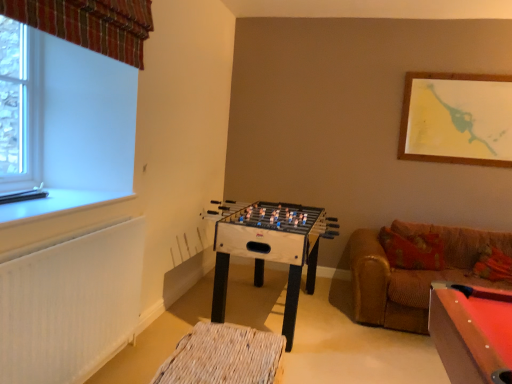
What do you see at coordinates (271, 250) in the screenshot? This screenshot has height=384, width=512. I see `wooden foosball table at center` at bounding box center [271, 250].

The height and width of the screenshot is (384, 512). Describe the element at coordinates (19, 106) in the screenshot. I see `clear glass window at upper left` at that location.

The height and width of the screenshot is (384, 512). What are the coordinates of `clear glass window at upper left` in the screenshot? It's located at point(19,106).

Describe the element at coordinates (224, 356) in the screenshot. The image size is (512, 384). I see `woven wood footrest at lower center` at that location.

Identify the location of wooden foosball table at center. Image resolution: width=512 pixels, height=384 pixels. (271, 250).

Is clear glass window at upper left in contact with white textured radiator at lower left?

clear glass window at upper left and white textured radiator at lower left are not in contact.

Which object is wider, clear glass window at upper left or white textured radiator at lower left?

With larger width is white textured radiator at lower left.

The image size is (512, 384). I want to click on bay window above the white textured radiator at lower left (from the image's perspective), so click(x=19, y=106).

Is clear glass window at upper left oriented away from white textured radiator at lower left?

No, clear glass window at upper left's orientation is not away from white textured radiator at lower left.

Considering the points (397, 295) and (262, 338), which point is behind, point (397, 295) or point (262, 338)?

The point (397, 295) is farther from the camera.

From a real-world perspective, is brown leather couch at right physically above woven wood footrest at lower center?

Yes, from a real-world perspective, brown leather couch at right is on top of woven wood footrest at lower center.

Is brown leather couch at right outside of woven wood footrest at lower center?

Yes, brown leather couch at right is not within woven wood footrest at lower center.

From the image's perspective, is white plastic window sill at left on brown leather couch at right?

Yes, from the image's perspective, white plastic window sill at left is above brown leather couch at right.

Locate an element on the screen. studio couch below the white plastic window sill at left (from a real-world perspective) is located at coordinates (412, 273).

Relative to brown leather couch at right, is white plastic window sill at left in front or behind?

Clearly, white plastic window sill at left is in front of brown leather couch at right.

Would you consider white plastic window sill at left to be distant from brown leather couch at right?

Indeed, white plastic window sill at left is not near brown leather couch at right.

Who is bigger, clear glass window at upper left or wooden foosball table at center?

Bigger between the two is wooden foosball table at center.

Is clear glass window at upper left positioned far away from wooden foosball table at center?

clear glass window at upper left is far away from wooden foosball table at center.

Is clear glass window at upper left aimed at wooden foosball table at center?

No, clear glass window at upper left is not turned towards wooden foosball table at center.

Considering the positions of objects white textured radiator at lower left and clear glass window at upper left in the image provided, who is more to the right, white textured radiator at lower left or clear glass window at upper left?

white textured radiator at lower left.

Is white textured radiator at lower left aimed at clear glass window at upper left?

No, white textured radiator at lower left is not turned towards clear glass window at upper left.

The height and width of the screenshot is (384, 512). What are the coordinates of `radiator in front of the clear glass window at upper left` in the screenshot? It's located at click(x=70, y=305).

From the picture: Which point is more distant from viewer, (51,281) or (36,151)?

Point (36,151)

Which is in front, point (51, 195) or point (247, 240)?

The point (51, 195) is more forward.

At what (x,y) coordinates should I click in order to perform the action: click on window sill located in front of the wooden foosball table at center. Please return your answer as a coordinate pair (x, y). This screenshot has height=384, width=512. Looking at the image, I should click on (57, 205).

From the image's perspective, is white plastic window sill at left below wooden foosball table at center?

Incorrect, from the image's perspective, white plastic window sill at left is higher than wooden foosball table at center.

Considering the sizes of white plastic window sill at left and wooden foosball table at center in the image, is white plastic window sill at left wider or thinner than wooden foosball table at center?

Clearly, white plastic window sill at left has less width compared to wooden foosball table at center.

Is the depth of woven wood footrest at lower center less than that of plaid fabric curtain at upper left?

No, woven wood footrest at lower center is further to the viewer.

Between woven wood footrest at lower center and plaid fabric curtain at upper left, which one has more height?

With more height is plaid fabric curtain at upper left.

Which of these two, woven wood footrest at lower center or plaid fabric curtain at upper left, is bigger?

woven wood footrest at lower center.

From a real-world perspective, is woven wood footrest at lower center physically above plaid fabric curtain at upper left?

No, from a real-world perspective, woven wood footrest at lower center is not above plaid fabric curtain at upper left.

Where is `radiator below the clear glass window at upper left (from the image's perspective)`? radiator below the clear glass window at upper left (from the image's perspective) is located at coordinates (70, 305).

What are the coordinates of `the footrest in front of the brown leather couch at right` in the screenshot? It's located at (224, 356).

Considering their positions, is white textured radiator at lower left positioned closer to white plastic window sill at left than brown leather couch at right?

white textured radiator at lower left.

Considering their positions, is plaid fabric curtain at upper left positioned further to woven wood footrest at lower center than white textured radiator at lower left?

plaid fabric curtain at upper left lies further to woven wood footrest at lower center than the other object.

When comparing their distances from plaid fabric curtain at upper left, does wooden foosball table at center or white plastic window sill at left seem closer?

The object closer to plaid fabric curtain at upper left is white plastic window sill at left.

Consider the image. Based on their spatial positions, is brown leather couch at right or woven wood footrest at lower center further from white textured radiator at lower left?

Among the two, brown leather couch at right is located further to white textured radiator at lower left.

Based on their spatial positions, is woven wood footrest at lower center or plaid fabric curtain at upper left further from wooden foosball table at center?

plaid fabric curtain at upper left is further to wooden foosball table at center.

Looking at the image, which one is located closer to plaid fabric curtain at upper left, wooden foosball table at center or clear glass window at upper left?

clear glass window at upper left is closer to plaid fabric curtain at upper left.

Looking at the image, which one is located closer to wooden foosball table at center, white plastic window sill at left or clear glass window at upper left?

white plastic window sill at left.

From the picture: Looking at the image, which one is located closer to white textured radiator at lower left, plaid fabric curtain at upper left or clear glass window at upper left?

clear glass window at upper left is positioned closer to the anchor white textured radiator at lower left.

This screenshot has height=384, width=512. What are the coordinates of `bay window between plaid fabric curtain at upper left and wooden foosball table at center in the vertical direction` in the screenshot? It's located at (19, 106).

Locate an element on the screen. This screenshot has width=512, height=384. table between woven wood footrest at lower center and brown leather couch at right from left to right is located at coordinates (271, 250).

I want to click on the footrest situated between clear glass window at upper left and brown leather couch at right from left to right, so click(224, 356).

You are a GUI agent. You are given a task and a screenshot of the screen. Output one action in this format:
    pyautogui.click(x=<x>, y=<y>)
    Task: Click on the bay window between plaid fabric curtain at upper left and white plastic window sill at left vertically
    The width and height of the screenshot is (512, 384).
    Given the screenshot: What is the action you would take?
    pyautogui.click(x=19, y=106)